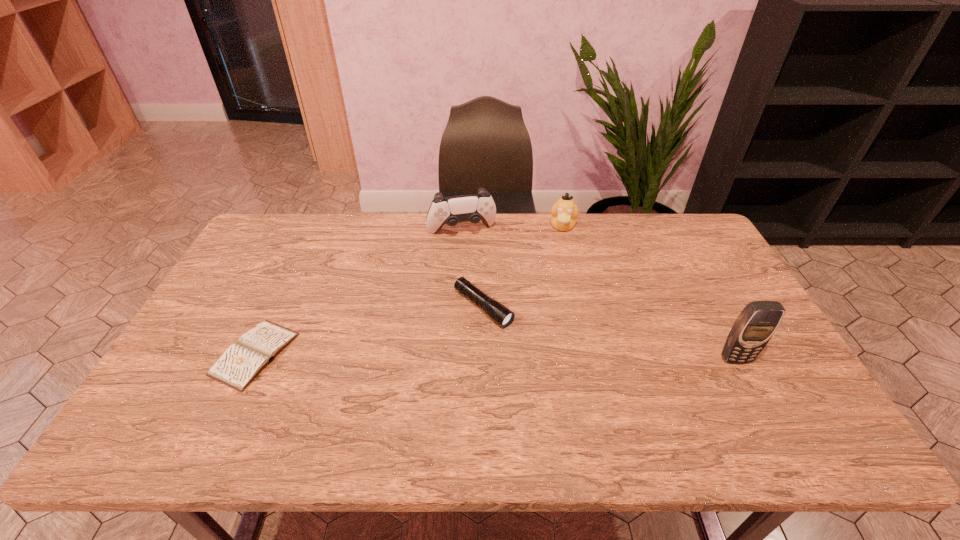
This screenshot has width=960, height=540. Identify the location of free space on the desktop that is between the leftmost object and the cellular telephone and is positioned at the lens end of the flashlight. (547, 357).

Where is `vacant spot on the desktop that is between the shortest object and the tallest object and is positioned on the front-facing side of the control`? The width and height of the screenshot is (960, 540). vacant spot on the desktop that is between the shortest object and the tallest object and is positioned on the front-facing side of the control is located at coordinates (500, 356).

Locate an element on the screen. free space on the desktop that is between the diary and the tallest object and is positioned on the face of the duckling is located at coordinates (548, 357).